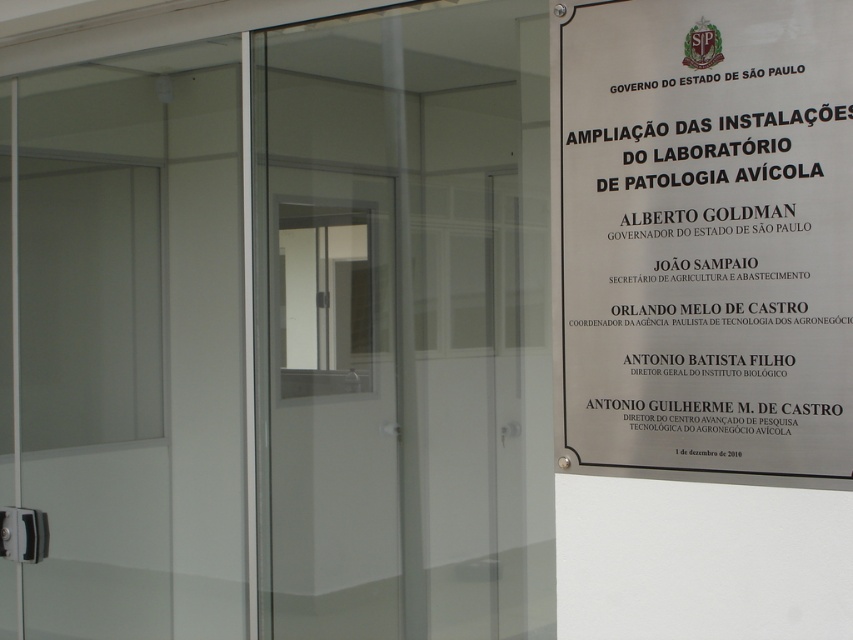
Question: Which object appears closest to the camera in this image?

Choices:
 (A) transparent glass door at center
 (B) metallic plaque at right
 (C) transparent glass screen door at center

Answer: (B)

Question: Can you confirm if metallic plaque at right is smaller than transparent glass screen door at center?

Choices:
 (A) no
 (B) yes

Answer: (B)

Question: Which point is closer to the camera?

Choices:
 (A) (612, 54)
 (B) (399, 452)

Answer: (A)

Question: Does metallic plaque at right appear on the left side of transparent glass screen door at center?

Choices:
 (A) yes
 (B) no

Answer: (B)

Question: Is transparent glass door at center in front of transparent glass screen door at center?

Choices:
 (A) yes
 (B) no

Answer: (A)

Question: Which point appears farthest from the camera in this image?

Choices:
 (A) (752, 376)
 (B) (311, 493)

Answer: (B)